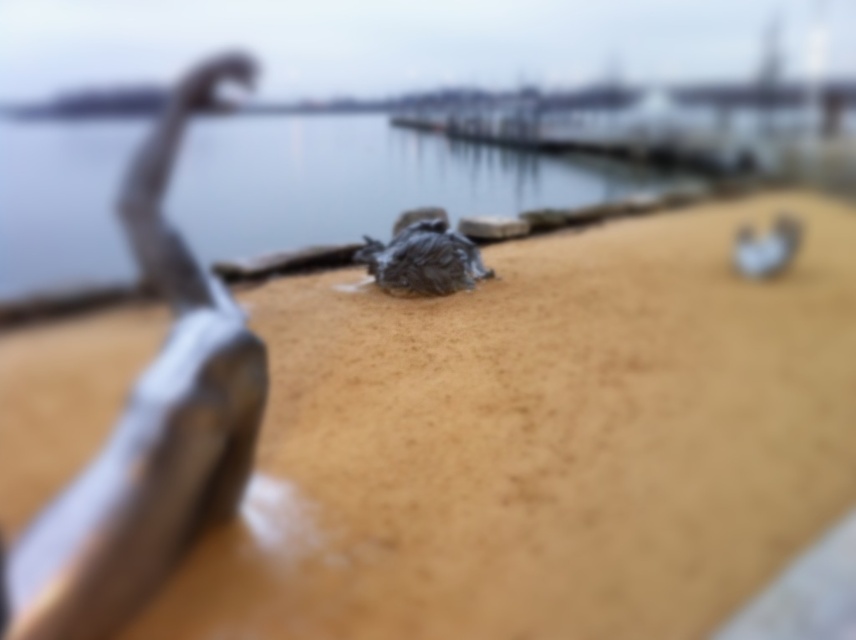
Question: Is brown matte sand at center wider than metallic silver sculpture at left?

Choices:
 (A) yes
 (B) no

Answer: (A)

Question: Is brown matte sand at center bigger than clear water at center?

Choices:
 (A) yes
 (B) no

Answer: (B)

Question: Which point is closer to the camera taking this photo?

Choices:
 (A) (15, 577)
 (B) (373, 134)
 (C) (117, 342)

Answer: (A)

Question: Which point is closer to the camera?

Choices:
 (A) brown matte sand at center
 (B) clear water at center

Answer: (A)

Question: Is clear water at center to the left of metallic silver sculpture at left from the viewer's perspective?

Choices:
 (A) yes
 (B) no

Answer: (B)

Question: Which of the following is the closest to the observer?

Choices:
 (A) clear water at center
 (B) metallic silver sculpture at left
 (C) brown matte sand at center

Answer: (B)